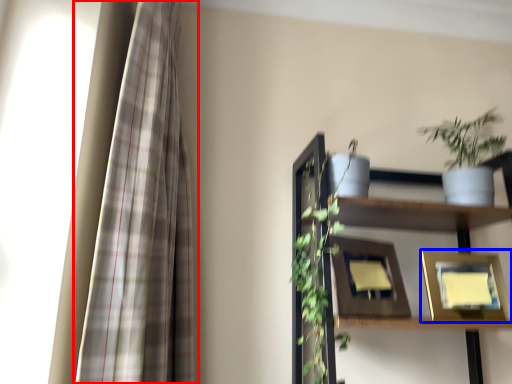
Question: Which object is further to the camera taking this photo, curtain (highlighted by a red box) or picture frame (highlighted by a blue box)?

Choices:
 (A) curtain
 (B) picture frame

Answer: (B)